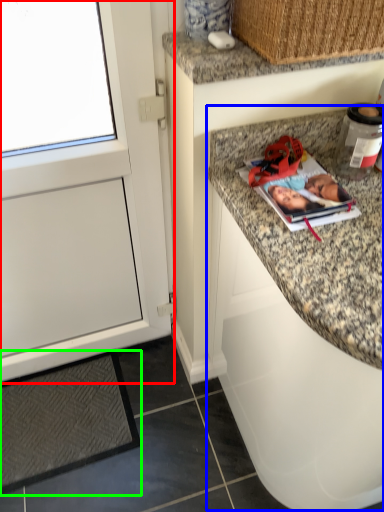
Question: Considering the real-world distances, which object is closest to cabinetry (highlighted by a red box)? cabinetry (highlighted by a blue box) or mat (highlighted by a green box).

Choices:
 (A) cabinetry
 (B) mat

Answer: (B)